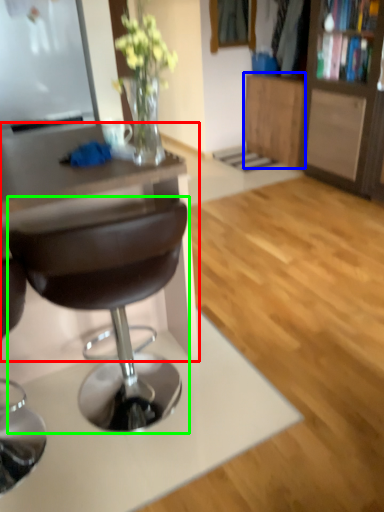
Question: Which is nearer to the desk (highlighted by a red box)? cabinetry (highlighted by a blue box) or chair (highlighted by a green box).

Choices:
 (A) cabinetry
 (B) chair

Answer: (B)